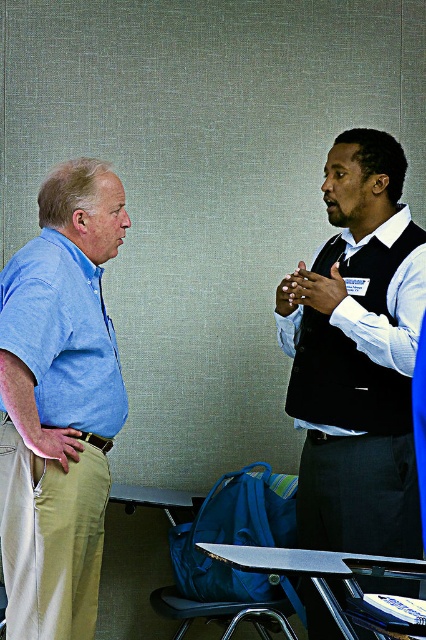
You are an event organizer who needs to ensure all attire meets size requirements. Given the khaki pants at left and the white glossy shirt at center, which item of clothing is larger in size?

The khaki pants at left is bigger than the white glossy shirt at center, so the khaki pants at left is the larger item.

In the scene shown: You are organizing a photoshoot and need to adjust lighting to ensure both the black vest at center and the white glossy shirt at center are well lit. Considering their positions, which one might require more direct lighting to avoid appearing too dark in the photo?

The black vest at center might require more direct lighting because it is in front of the white glossy shirt at center, which could reflect some light onto it. However, since black absorbs more light, additional lighting on the black vest at center would help it appear properly exposed.